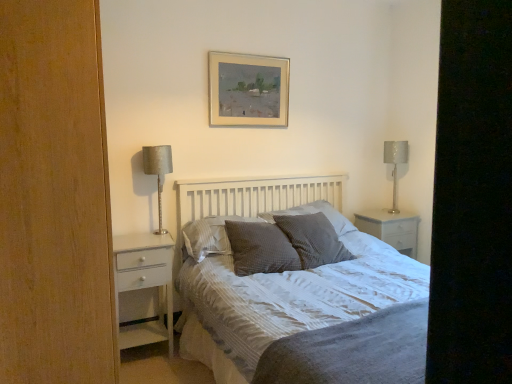
Image resolution: width=512 pixels, height=384 pixels. What do you see at coordinates (314, 213) in the screenshot?
I see `gray textured pillow at center, which is counted as the 1th pillow, starting from the right` at bounding box center [314, 213].

The height and width of the screenshot is (384, 512). Describe the element at coordinates (209, 236) in the screenshot. I see `gray textured pillow at center, the fourth pillow from the right` at that location.

At what (x,y) coordinates should I click in order to perform the action: click on textured gray bed at center. Please return your answer as a coordinate pair (x, y). The height and width of the screenshot is (384, 512). Looking at the image, I should click on (295, 302).

What is the approximate height of white glossy chest of drawers at left?

It is 30.85 inches.

Image resolution: width=512 pixels, height=384 pixels. I want to click on gray textured pillow at center, which is counted as the 1th pillow, starting from the right, so click(x=314, y=213).

Is point (399, 262) positioned behind point (456, 146)?

Yes.

From a real-world perspective, is textured gray bed at center located beneath black matte screen door at right?

Correct, in the physical world, textured gray bed at center is lower than black matte screen door at right.

In the image, is textured gray bed at center on the left side or the right side of black matte screen door at right?

textured gray bed at center is to the left of black matte screen door at right.

Considering the sizes of objects textured gray bed at center and black matte screen door at right in the image provided, who is thinner, textured gray bed at center or black matte screen door at right?

Thinner between the two is black matte screen door at right.

Considering the sizes of objects metallic silver table lamp at right, which is counted as the 2th table lamp, starting from the front, and silver metallic picture frame at upper center in the image provided, who is smaller, metallic silver table lamp at right, which is counted as the 2th table lamp, starting from the front, or silver metallic picture frame at upper center?

silver metallic picture frame at upper center is smaller.

Would you say metallic silver table lamp at right, the 2th table lamp when ordered from left to right, is to the left or to the right of silver metallic picture frame at upper center in the picture?

From the image, it's evident that metallic silver table lamp at right, the 2th table lamp when ordered from left to right, is to the right of silver metallic picture frame at upper center.

From a real-world perspective, who is located higher, metallic silver table lamp at right, placed as the 1th table lamp when sorted from back to front, or silver metallic picture frame at upper center?

silver metallic picture frame at upper center is physically above.

Is metallic silver table lamp at right, which is counted as the 2th table lamp, starting from the front, looking in the opposite direction of silver metallic picture frame at upper center?

No, silver metallic picture frame at upper center is not at the back of metallic silver table lamp at right, which is counted as the 2th table lamp, starting from the front.

From a real-world perspective, does gray textured pillow at center, positioned as the fourth pillow in left-to-right order, sit lower than textured gray bed at center?

No, from a real-world perspective, gray textured pillow at center, positioned as the fourth pillow in left-to-right order, is not below textured gray bed at center.

From the image's perspective, is gray textured pillow at center, which is counted as the 1th pillow, starting from the right, located above textured gray bed at center?

Yes, from the image's perspective, gray textured pillow at center, which is counted as the 1th pillow, starting from the right, is above textured gray bed at center.

From the picture: Considering the sizes of gray textured pillow at center, which is counted as the 1th pillow, starting from the right, and textured gray bed at center in the image, is gray textured pillow at center, which is counted as the 1th pillow, starting from the right, taller or shorter than textured gray bed at center?

In the image, gray textured pillow at center, which is counted as the 1th pillow, starting from the right, appears to be shorter than textured gray bed at center.

Who is shorter, gray textured pillow at center, acting as the 2th pillow starting from the left, or white glossy chest of drawers at left?

With less height is gray textured pillow at center, acting as the 2th pillow starting from the left.

Considering the positions of objects gray textured pillow at center, the 3th pillow viewed from the right, and white glossy chest of drawers at left in the image provided, who is in front, gray textured pillow at center, the 3th pillow viewed from the right, or white glossy chest of drawers at left?

white glossy chest of drawers at left is closer to the camera.

Considering the relative sizes of gray textured pillow at center, the 3th pillow viewed from the right, and white glossy chest of drawers at left in the image provided, is gray textured pillow at center, the 3th pillow viewed from the right, wider than white glossy chest of drawers at left?

Indeed, gray textured pillow at center, the 3th pillow viewed from the right, has a greater width compared to white glossy chest of drawers at left.

At what (x,y) coordinates should I click in order to perform the action: click on table lamp that is the 1st one below the black matte screen door at right (from a real-world perspective). Please return your answer as a coordinate pair (x, y). Looking at the image, I should click on (158, 172).

Is the depth of black matte screen door at right greater than that of satin silver lamp at left, placed as the first table lamp when sorted from front to back?

No, black matte screen door at right is closer to the camera.

From a real-world perspective, is black matte screen door at right above or below satin silver lamp at left, placed as the first table lamp when sorted from front to back?

In terms of real-world spatial position, black matte screen door at right is above satin silver lamp at left, placed as the first table lamp when sorted from front to back.

Does black matte screen door at right have a greater width compared to satin silver lamp at left, placed as the first table lamp when sorted from front to back?

No, black matte screen door at right is not wider than satin silver lamp at left, placed as the first table lamp when sorted from front to back.

Does white glossy chest of drawers at left have a smaller size compared to black matte screen door at right?

Correct, white glossy chest of drawers at left occupies less space than black matte screen door at right.

Does white glossy chest of drawers at left contain black matte screen door at right?

No, black matte screen door at right is not a part of white glossy chest of drawers at left.

Could you tell me if white glossy chest of drawers at left is facing black matte screen door at right?

No, white glossy chest of drawers at left is not turned towards black matte screen door at right.

From a real-world perspective, count 3rd pillows upward from the white glossy chest of drawers at left and point to it. Please provide its 2D coordinates.

[(209, 236)]

Could you tell me if gray textured pillow at center, the fourth pillow from the right, is facing white glossy chest of drawers at left?

No.

Relative to white glossy chest of drawers at left, is gray textured pillow at center, the fourth pillow from the right, in front or behind?

gray textured pillow at center, the fourth pillow from the right, is behind white glossy chest of drawers at left.

From the picture: Can we say gray textured pillow at center, the first pillow viewed from the left, lies outside white glossy chest of drawers at left?

Yes, gray textured pillow at center, the first pillow viewed from the left, is not within white glossy chest of drawers at left.

Where is `screen door behind the textured gray bed at center`? The height and width of the screenshot is (384, 512). screen door behind the textured gray bed at center is located at coordinates (472, 198).

In order to click on table lamp that is the 2nd one below the silver metallic picture frame at upper center (from a real-world perspective) in this screenshot , I will do `click(395, 164)`.

When comparing their distances from gray textured pillow at center, positioned as the fourth pillow in left-to-right order, does white glossy chest of drawers at left or metallic silver table lamp at right, the 2th table lamp when ordered from left to right, seem further?

Based on the image, white glossy chest of drawers at left appears to be further to gray textured pillow at center, positioned as the fourth pillow in left-to-right order.

When comparing their distances from silver metallic picture frame at upper center, does waffle-textured gray pillow at center, placed as the second pillow when sorted from right to left, or white glossy nightstand at right seem closer?

waffle-textured gray pillow at center, placed as the second pillow when sorted from right to left.

Considering their positions, is textured gray bed at center positioned further to white glossy nightstand at right than white glossy chest of drawers at left?

white glossy chest of drawers at left is further to white glossy nightstand at right.

Estimate the real-world distances between objects in this image. Which object is closer to satin silver lamp at left, the second table lamp in the right-to-left sequence, gray textured pillow at center, the fourth pillow from the right, or gray textured pillow at center, positioned as the fourth pillow in left-to-right order?

gray textured pillow at center, the fourth pillow from the right, lies closer to satin silver lamp at left, the second table lamp in the right-to-left sequence, than the other object.

Based on their spatial positions, is black matte screen door at right or waffle-textured gray pillow at center, placed as the second pillow when sorted from right to left, further from silver metallic picture frame at upper center?

black matte screen door at right lies further to silver metallic picture frame at upper center than the other object.

From the image, which object appears to be farther from gray textured pillow at center, acting as the 2th pillow starting from the left, waffle-textured gray pillow at center, placed as the 3th pillow when sorted from left to right, or silver metallic picture frame at upper center?

Based on the image, silver metallic picture frame at upper center appears to be further to gray textured pillow at center, acting as the 2th pillow starting from the left.

Considering their positions, is white glossy chest of drawers at left positioned closer to satin silver lamp at left, placed as the first table lamp when sorted from front to back, than textured gray bed at center?

Based on the image, white glossy chest of drawers at left appears to be nearer to satin silver lamp at left, placed as the first table lamp when sorted from front to back.

When comparing their distances from metallic silver table lamp at right, placed as the 1th table lamp when sorted from back to front, does satin silver lamp at left, arranged as the 2th table lamp when viewed from the back, or gray textured pillow at center, which is counted as the 1th pillow, starting from the right, seem closer?

gray textured pillow at center, which is counted as the 1th pillow, starting from the right, is closer to metallic silver table lamp at right, placed as the 1th table lamp when sorted from back to front.

Identify the location of picture frame positioned between textured gray bed at center and metallic silver table lamp at right, the 1th table lamp from the right, from near to far. (248, 90).

I want to click on pillow located between textured gray bed at center and black matte screen door at right in the depth direction, so click(x=260, y=248).

Where is `nightstand between gray textured pillow at center, positioned as the fourth pillow in left-to-right order, and black matte screen door at right`? The width and height of the screenshot is (512, 384). nightstand between gray textured pillow at center, positioned as the fourth pillow in left-to-right order, and black matte screen door at right is located at coordinates (391, 228).

I want to click on table lamp situated between waffle-textured gray pillow at center, placed as the 3th pillow when sorted from left to right, and black matte screen door at right from left to right, so click(395, 164).